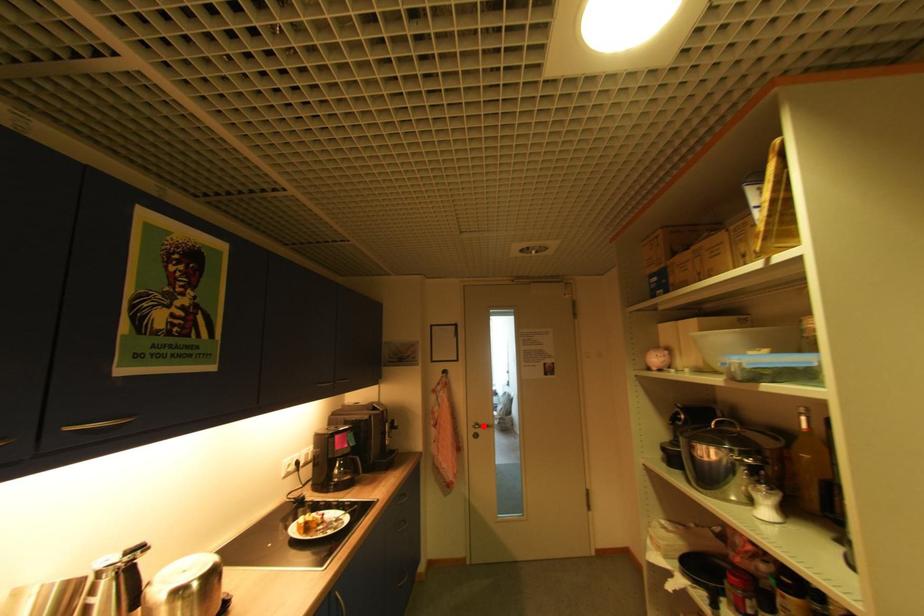
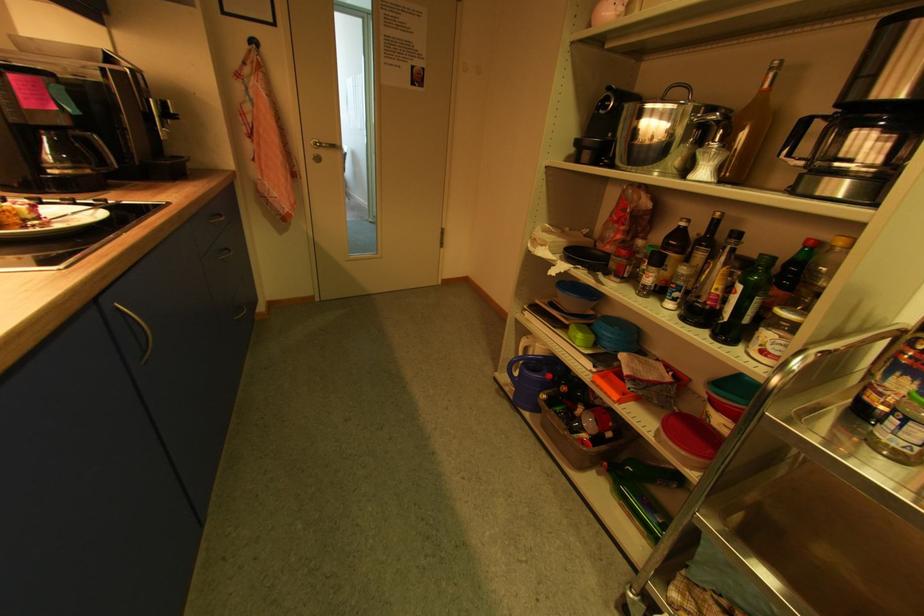
Question: I am providing you with two images of the same scene from different viewpoints. In image1, a red point is highlighted. Considering the same 3D point in image2, which of the following is correct?

Choices:
 (A) It is closer
 (B) It is farther

Answer: (A)